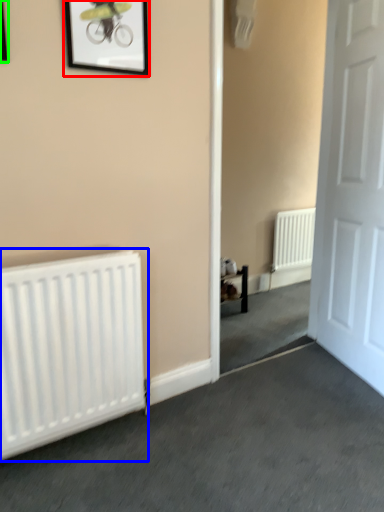
Question: Based on their relative distances, which object is nearer to picture frame (highlighted by a red box)? Choose from radiator (highlighted by a blue box) and picture frame (highlighted by a green box).

Choices:
 (A) radiator
 (B) picture frame

Answer: (B)